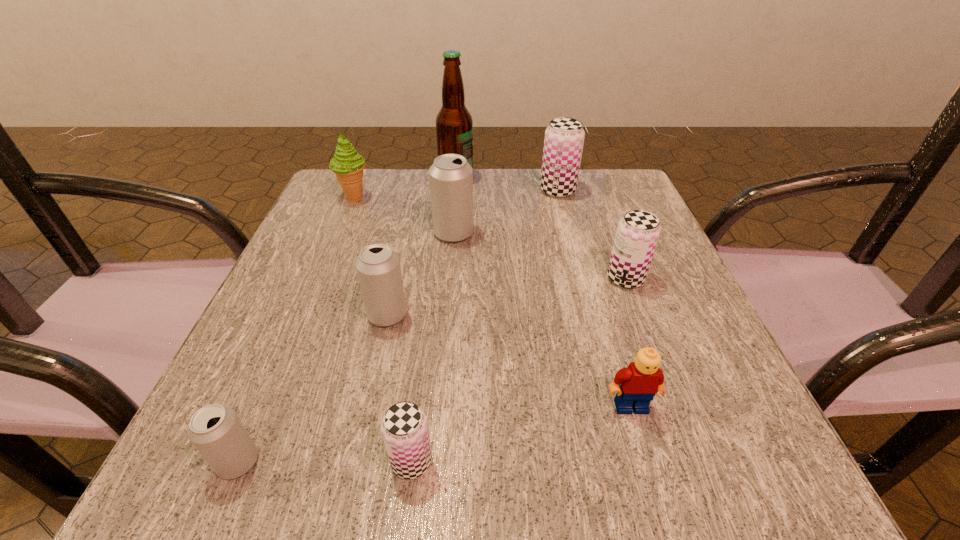
Where is `free space located 0.190m on the front of the green icecream`? free space located 0.190m on the front of the green icecream is located at coordinates (329, 259).

Find the location of a particular element. The image size is (960, 540). vacant region located 0.080m on the back of the rightmost purple beer can is located at coordinates (612, 242).

Find the location of a particular element. free space located 0.180m on the left of the second biggest white beer can is located at coordinates (262, 314).

Identify the location of vacant space located on the front-facing side of the yellow Lego. Image resolution: width=960 pixels, height=540 pixels. (650, 473).

Locate an element on the screen. The height and width of the screenshot is (540, 960). vacant point located on the left of the nearest purple beer can is located at coordinates (303, 461).

The width and height of the screenshot is (960, 540). I want to click on free spot located on the right of the smallest white beer can, so click(472, 462).

Identify the location of beer bottle positioned at the far edge. Image resolution: width=960 pixels, height=540 pixels. tap(454, 125).

The height and width of the screenshot is (540, 960). I want to click on beer can that is at the far edge, so click(x=563, y=144).

Identify the location of icecream that is at the far edge. (347, 164).

The width and height of the screenshot is (960, 540). Identify the location of icecream present at the left edge. (347, 164).